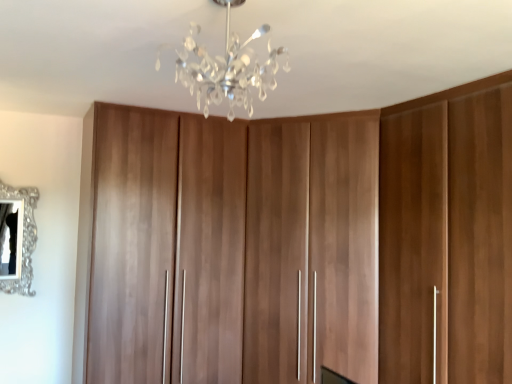
Question: Is clear crystal chandelier at upper center inside the boundaries of silver ornate mirror at left, or outside?

Choices:
 (A) inside
 (B) outside

Answer: (B)

Question: In the image, is clear crystal chandelier at upper center positioned in front of or behind silver ornate mirror at left?

Choices:
 (A) front
 (B) behind

Answer: (A)

Question: Which object is the farthest from the walnut wood cupboard at center?

Choices:
 (A) clear crystal chandelier at upper center
 (B) silver ornate mirror at left

Answer: (B)

Question: Estimate the real-world distances between objects in this image. Which object is closer to the silver ornate mirror at left?

Choices:
 (A) clear crystal chandelier at upper center
 (B) walnut wood cupboard at center

Answer: (B)